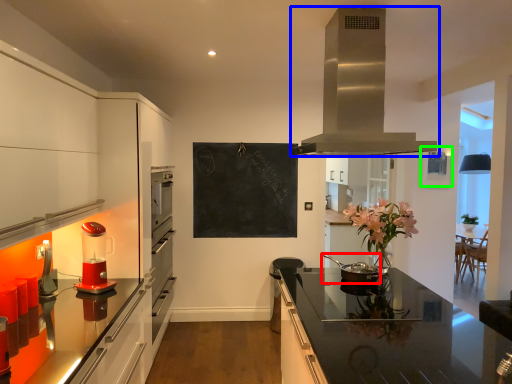
Question: Which object is positioned closest to kitchen appliance (highlighted by a red box)? Select from home appliance (highlighted by a blue box) and picture frame (highlighted by a green box).

Choices:
 (A) home appliance
 (B) picture frame

Answer: (A)